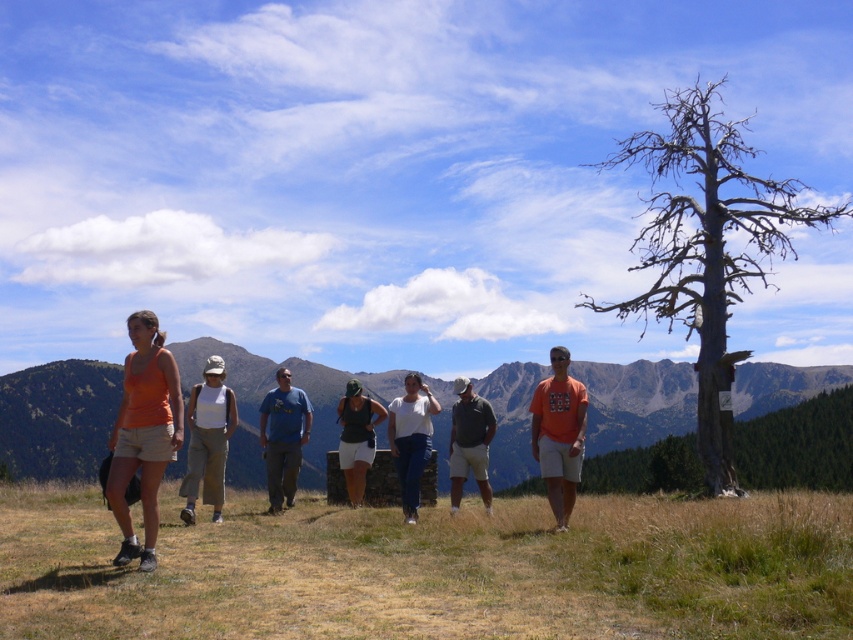
You are part of the hiking group and want to take a photo of the green grassy mountain at center and the matte black tank top at center. Which object should you focus on first if you want to capture both in the same frame?

The matte black tank top at center should be focused on first because the green grassy mountain at center is positioned to its right, so adjusting focus from the tank top to the mountain would ensure both are in the frame.

You are a photographer standing at the edge of the grassy field. You want to take a photo of the green grassy mountain at center so that it fills the frame without any distortion. What is the minimum distance you need to be from the mountain to achieve this?

The minimum distance you need to be from the green grassy mountain at center is 18.12 meters to capture it without distortion.